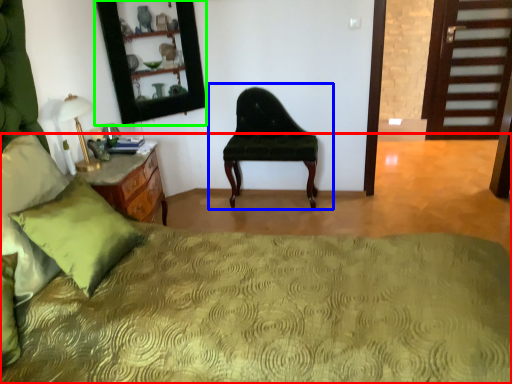
Question: Considering the real-world distances, which object is farthest from bed (highlighted by a red box)? chair (highlighted by a blue box) or mirror (highlighted by a green box)?

Choices:
 (A) chair
 (B) mirror

Answer: (B)